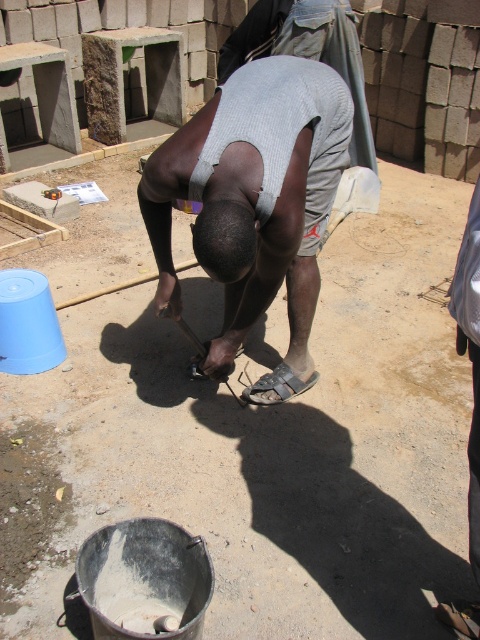
Where is `gray fabric shirt at center`? gray fabric shirt at center is located at coordinates (254, 202).

Is point (249, 67) positioned in front of point (160, 314)?

That is True.

What are the coordinates of `gray fabric shirt at center` in the screenshot? It's located at (254, 202).